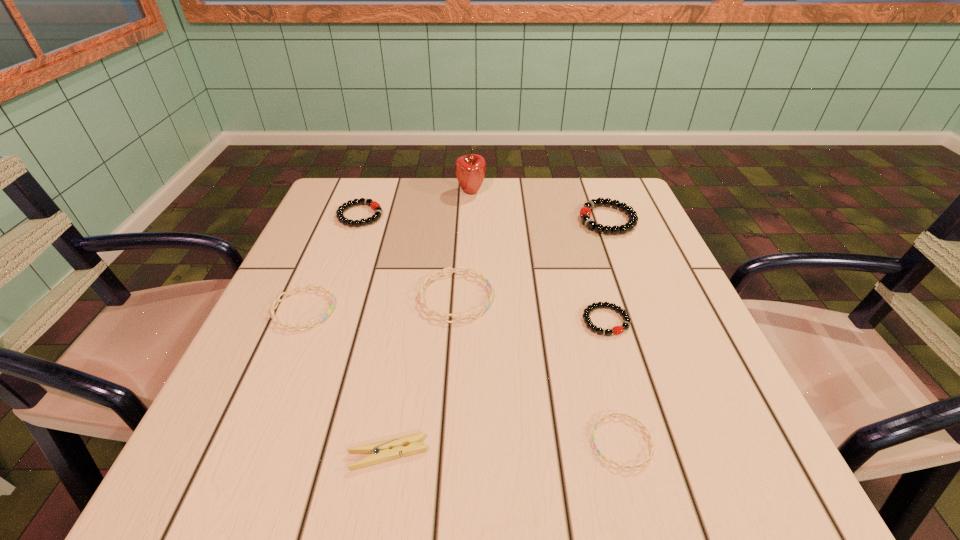
Locate an element on the screen. The width and height of the screenshot is (960, 540). the smallest blue bracelet is located at coordinates (635, 420).

Locate an element on the screen. The width and height of the screenshot is (960, 540). vacant space situated 0.110m on the left of the farthest object is located at coordinates (416, 192).

Where is `blank space located 0.190m on the left of the biggest black bracelet`? This screenshot has height=540, width=960. blank space located 0.190m on the left of the biggest black bracelet is located at coordinates pos(502,220).

This screenshot has height=540, width=960. What are the coordinates of `free space located on the surface of the second blue bracelet from right to left showing star-shaped elements` in the screenshot? It's located at (597, 297).

The width and height of the screenshot is (960, 540). What are the coordinates of `free region located on the right of the second biggest black bracelet` in the screenshot? It's located at (419, 215).

Identify the location of vacant space located 0.180m on the surface of the second biggest blue bracelet showing star-shaped elements. The image size is (960, 540). (426, 309).

The image size is (960, 540). I want to click on free space located 0.290m on the back of the nearest black bracelet, so click(577, 222).

Where is `vacant space located 0.190m on the back of the clothespin`? This screenshot has height=540, width=960. vacant space located 0.190m on the back of the clothespin is located at coordinates (407, 340).

At what (x,y) coordinates should I click in order to perform the action: click on vacant space located on the surface of the smallest blue bracelet showing star-shaped elements. Please return your answer as a coordinate pair (x, y). Looking at the image, I should click on (370, 442).

Locate an element on the screen. blank space located on the surface of the smallest blue bracelet showing star-shaped elements is located at coordinates (376, 442).